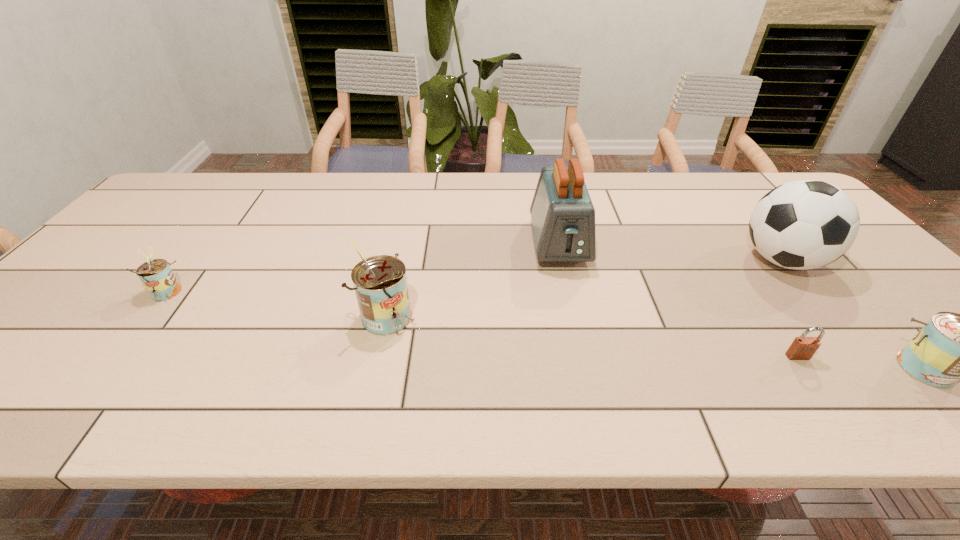
Where is `the fifth tallest object`? The image size is (960, 540). the fifth tallest object is located at coordinates (156, 275).

In order to click on the leftmost object in this screenshot , I will do `click(156, 275)`.

I want to click on the second can from left to right, so click(380, 283).

The height and width of the screenshot is (540, 960). Identify the location of soccer ball. (805, 224).

Image resolution: width=960 pixels, height=540 pixels. Find the location of `the third object from left to right`. the third object from left to right is located at coordinates (563, 217).

Where is `padlock`? This screenshot has height=540, width=960. padlock is located at coordinates (802, 348).

I want to click on vacant region located 0.110m on the front of the leftmost object, so coord(127,339).

The width and height of the screenshot is (960, 540). In order to click on vacant space located on the left of the second can from left to right in this screenshot , I will do `click(330, 315)`.

What are the coordinates of `vacant space located on the back of the soccer ball` in the screenshot? It's located at (748, 218).

You are a GUI agent. You are given a task and a screenshot of the screen. Output one action in this format:
    pyautogui.click(x=<x>, y=<y>)
    Task: Click on the free region located on the front-facing side of the toaster
    
    Given the screenshot: What is the action you would take?
    pyautogui.click(x=582, y=347)